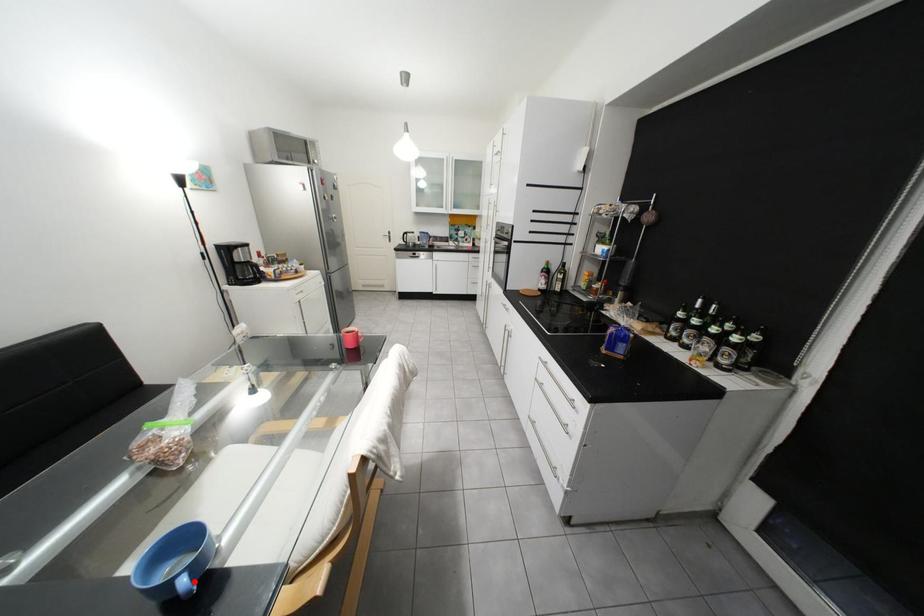
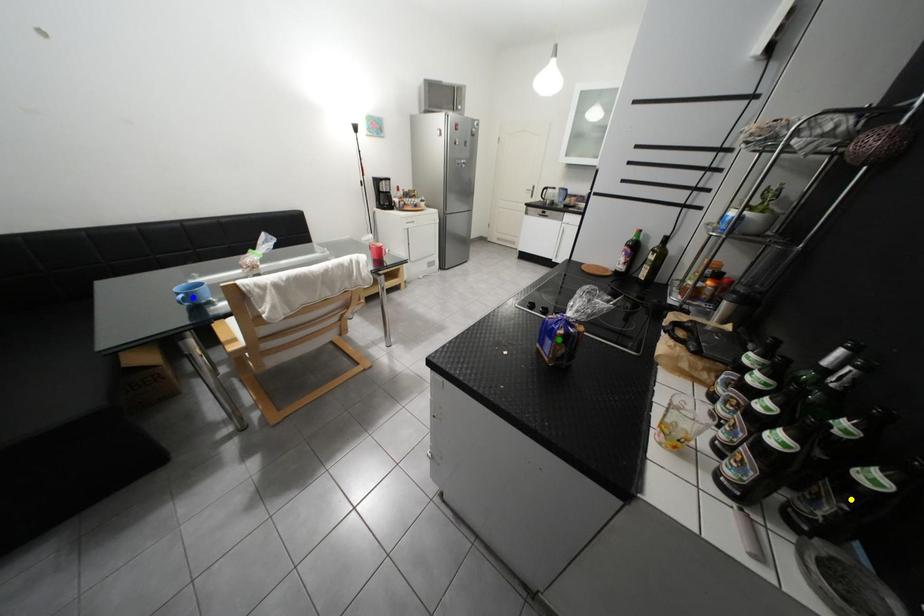
Question: I am providing you with two images of the same scene from different viewpoints. A red point is marked on the first image. You are given multiple points on the second image. Which point in image 2 represents the same 3d spot as the red point in image 1?

Choices:
 (A) yellow point
 (B) blue point
 (C) green point

Answer: (B)